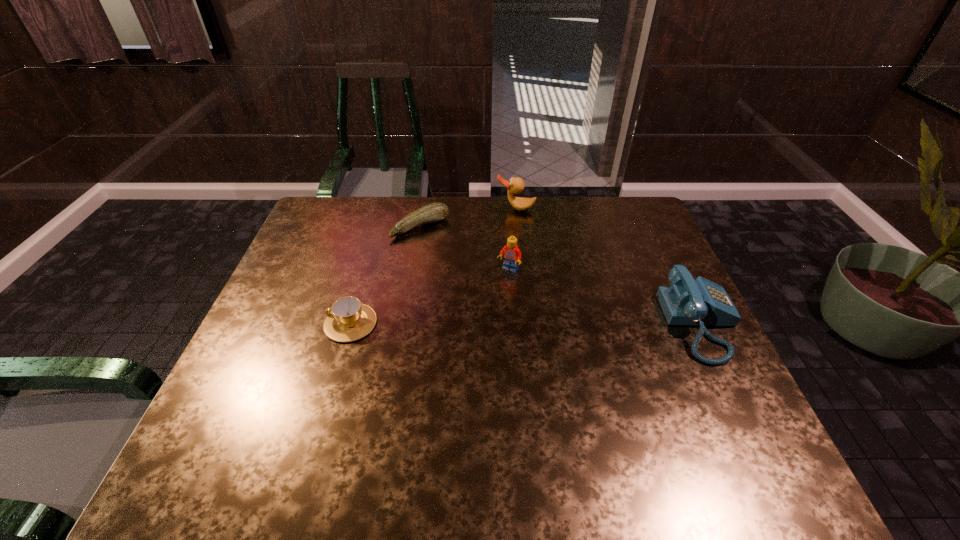
Locate an element on the screen. free location located on the beak of the farthest object is located at coordinates (511, 224).

The height and width of the screenshot is (540, 960). What are the coordinates of `free region located at the stem end of the fourth nearest object` in the screenshot? It's located at (459, 265).

Where is `vacant space located 0.290m at the stem end of the fourth nearest object`? vacant space located 0.290m at the stem end of the fourth nearest object is located at coordinates (485, 292).

Where is `vacant space positioned at the stem end of the fourth nearest object`? This screenshot has width=960, height=540. vacant space positioned at the stem end of the fourth nearest object is located at coordinates (450, 256).

In order to click on vacant space located 0.050m on the face of the Lego in this screenshot , I will do `click(497, 286)`.

Find the location of `vacant region located on the face of the Lego`. vacant region located on the face of the Lego is located at coordinates (473, 322).

Where is `free space located on the face of the Lego`? This screenshot has height=540, width=960. free space located on the face of the Lego is located at coordinates click(494, 291).

This screenshot has width=960, height=540. Find the location of `duck present at the far edge`. duck present at the far edge is located at coordinates (516, 185).

Identify the location of zucchini situated at the far edge. This screenshot has width=960, height=540. (437, 211).

This screenshot has width=960, height=540. I want to click on object at the right edge, so click(701, 302).